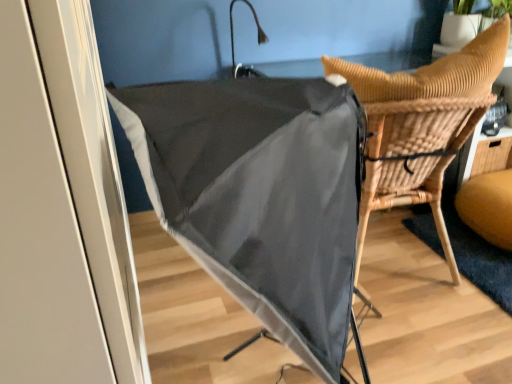
Question: From the image's perspective, is woven wood table at right on woven wood chair at center?

Choices:
 (A) yes
 (B) no

Answer: (A)

Question: Considering the relative sizes of woven wood table at right and woven wood chair at center in the image provided, is woven wood table at right smaller than woven wood chair at center?

Choices:
 (A) yes
 (B) no

Answer: (A)

Question: Is woven wood table at right positioned with its back to woven wood chair at center?

Choices:
 (A) no
 (B) yes

Answer: (A)

Question: Is woven wood table at right surrounding woven wood chair at center?

Choices:
 (A) no
 (B) yes

Answer: (A)

Question: Can you confirm if woven wood table at right is wider than woven wood chair at center?

Choices:
 (A) no
 (B) yes

Answer: (A)

Question: Considering the relative positions of woven wood table at right and woven wood chair at center in the image provided, is woven wood table at right to the right of woven wood chair at center from the viewer's perspective?

Choices:
 (A) yes
 (B) no

Answer: (A)

Question: Considering the relative sizes of matte black umbrella at center and woven wood chair at center in the image provided, is matte black umbrella at center shorter than woven wood chair at center?

Choices:
 (A) yes
 (B) no

Answer: (B)

Question: Is matte black umbrella at center completely or partially outside of woven wood chair at center?

Choices:
 (A) yes
 (B) no

Answer: (A)

Question: Is matte black umbrella at center not close to woven wood chair at center?

Choices:
 (A) yes
 (B) no

Answer: (B)

Question: From the image's perspective, is matte black umbrella at center below woven wood chair at center?

Choices:
 (A) no
 (B) yes

Answer: (B)

Question: Considering the relative sizes of matte black umbrella at center and woven wood chair at center in the image provided, is matte black umbrella at center taller than woven wood chair at center?

Choices:
 (A) no
 (B) yes

Answer: (B)

Question: Is matte black umbrella at center facing away from woven wood chair at center?

Choices:
 (A) no
 (B) yes

Answer: (A)

Question: Considering the relative sizes of woven wood chair at center and woven wood table at right in the image provided, is woven wood chair at center shorter than woven wood table at right?

Choices:
 (A) no
 (B) yes

Answer: (A)